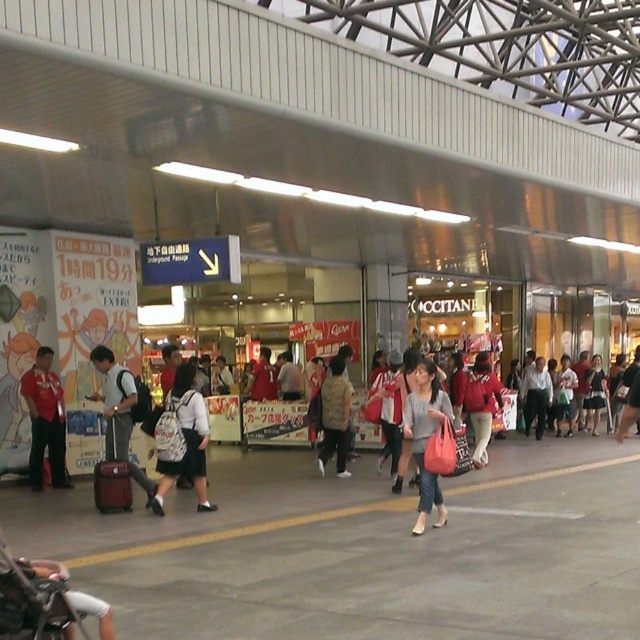
Question: Is matte red shirt at left wider than light brown backpack at center?

Choices:
 (A) no
 (B) yes

Answer: (B)

Question: Can you confirm if white backpack at center is positioned above matte red shirt at left?

Choices:
 (A) no
 (B) yes

Answer: (B)

Question: Is white backpack at center below matte black backpack at center?

Choices:
 (A) yes
 (B) no

Answer: (A)

Question: Which is nearer to the light brown backpack at center?

Choices:
 (A) matte red jacket at center
 (B) matte red shirt at left

Answer: (A)

Question: Which of the following is the farthest from the observer?

Choices:
 (A) light brown backpack at center
 (B) matte red jacket at center
 (C) white backpack at center

Answer: (B)

Question: Which point is closer to the camera?

Choices:
 (A) light gray fabric bag at center
 (B) white backpack at center

Answer: (A)